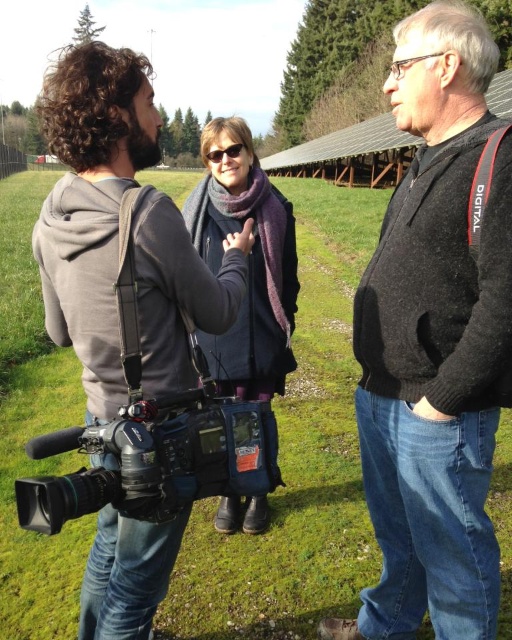
Is point (401, 355) closer to viewer compared to point (236, 154)?

Yes, it is.

Can you confirm if black wool sweater at right is positioned to the left of matte black sunglasses at center?

In fact, black wool sweater at right is to the right of matte black sunglasses at center.

The height and width of the screenshot is (640, 512). What do you see at coordinates (435, 342) in the screenshot?
I see `black wool sweater at right` at bounding box center [435, 342].

Where is `black wool sweater at right`? black wool sweater at right is located at coordinates (435, 342).

Is black wool sweater at right above purple wool scarf at center?

Correct, black wool sweater at right is located above purple wool scarf at center.

You are a GUI agent. You are given a task and a screenshot of the screen. Output one action in this format:
    pyautogui.click(x=<x>, y=<y>)
    Task: Click on the black wool sweater at right
    This screenshot has height=640, width=512.
    Given the screenshot: What is the action you would take?
    pyautogui.click(x=435, y=342)

Based on the photo, is black wool sweater at right bigger than black matte camera at lower left?

Yes, black wool sweater at right is bigger than black matte camera at lower left.

Is point (416, 560) positioned after point (168, 484)?

Yes.

Between point (453, 419) and point (74, 499), which one is positioned behind?

Positioned behind is point (453, 419).

Find the location of a particular element. The width and height of the screenshot is (512, 640). black wool sweater at right is located at coordinates point(435,342).